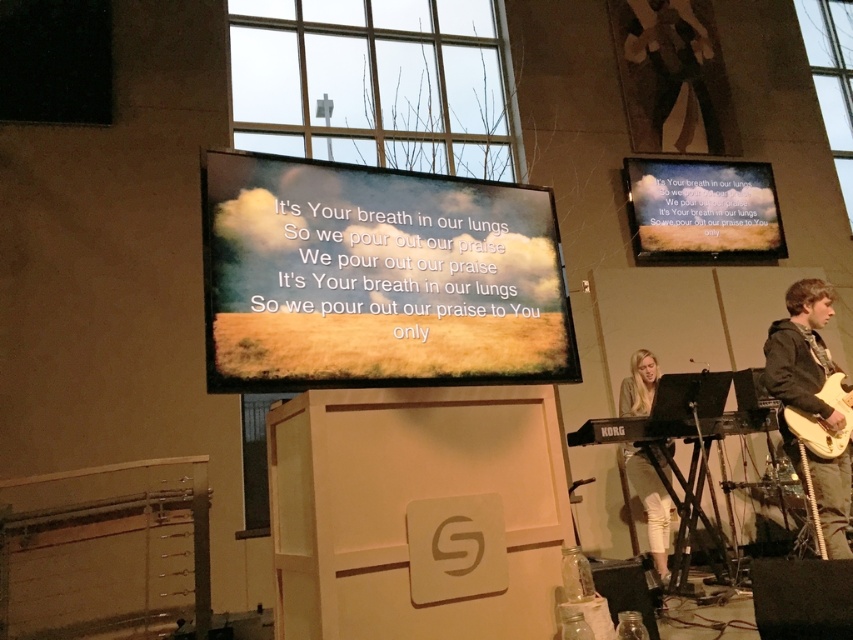
At what (x,y) coordinates should I click in order to perform the action: click on blonde hair at lower center. Please return your answer as a coordinate pair (x, y). Looking at the image, I should click on (651, 506).

Based on the photo, is blonde hair at lower center further to the viewer compared to light wood electric guitar at right?

Yes.

Based on the photo, who is more distant from viewer, [660,544] or [825,458]?

Point [660,544]

Identify the location of blonde hair at lower center. This screenshot has height=640, width=853. (651, 506).

You are a GUI agent. You are given a task and a screenshot of the screen. Output one action in this format:
    pyautogui.click(x=<x>, y=<y>)
    Task: Click on the matte black projection screen at upper right
    This screenshot has width=853, height=640.
    Given the screenshot: What is the action you would take?
    [701, 211]

Based on the photo, can you confirm if matte black projection screen at upper right is positioned to the left of blonde hair at lower center?

No, matte black projection screen at upper right is not to the left of blonde hair at lower center.

Is point (676, 189) farther from camera compared to point (645, 385)?

Yes, it is behind point (645, 385).

The width and height of the screenshot is (853, 640). Find the location of `matte black projection screen at upper right`. matte black projection screen at upper right is located at coordinates (701, 211).

Is matte glass projection screen at center in front of matte black projection screen at upper right?

Yes, matte glass projection screen at center is closer to the viewer.

Between matte glass projection screen at center and matte black projection screen at upper right, which one appears on the right side from the viewer's perspective?

From the viewer's perspective, matte black projection screen at upper right appears more on the right side.

Does point (466, 188) come farther from viewer compared to point (740, 168)?

No, (466, 188) is in front of (740, 168).

Identify the location of matte glass projection screen at center. The height and width of the screenshot is (640, 853). click(x=376, y=278).